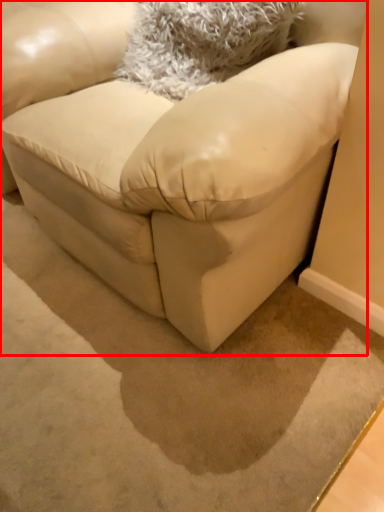
Question: From the image's perspective, where is studio couch (annotated by the red box) located relative to throw pillow?

Choices:
 (A) above
 (B) below

Answer: (B)